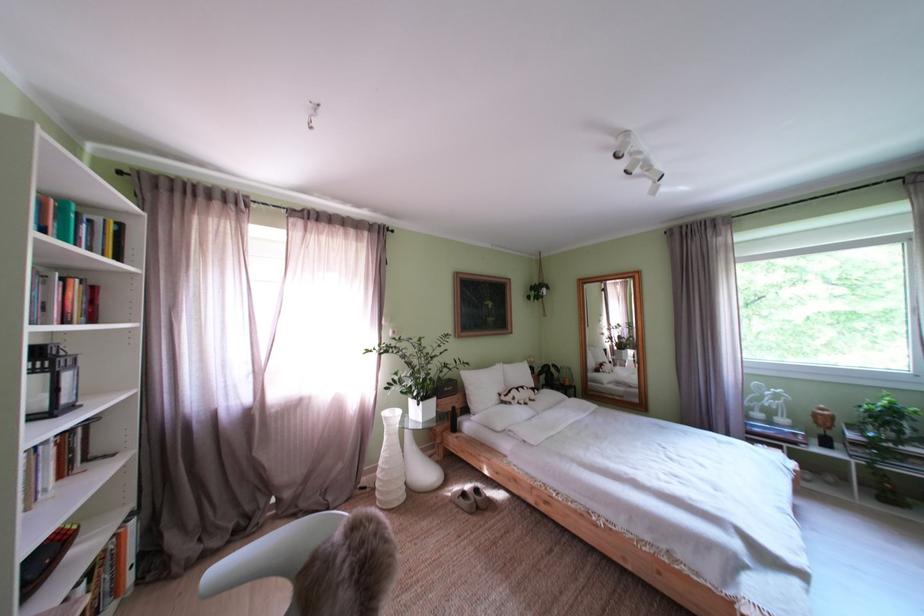
Where would you lift the grey slipper? Please return your answer as a coordinate pair (x, y).

(469, 498)